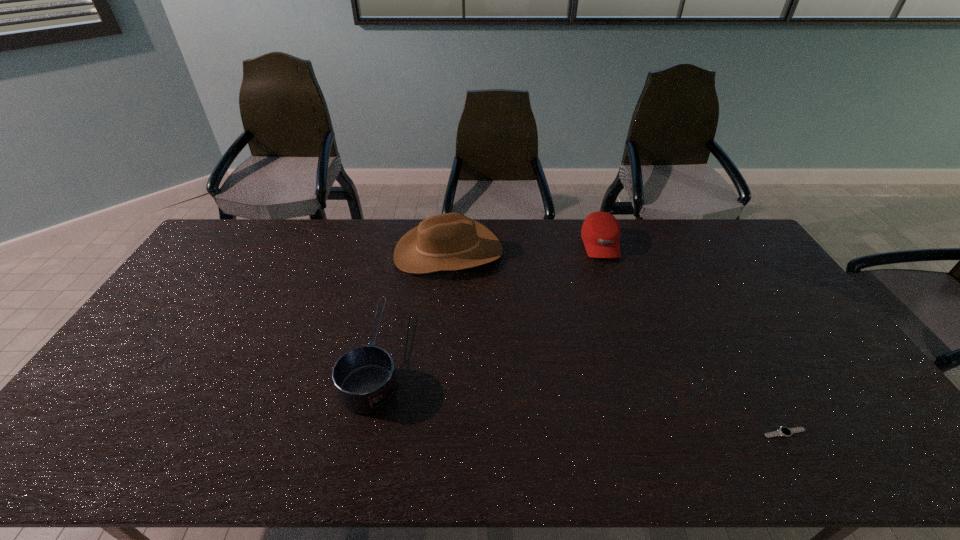
In order to click on free spot between the third object from left to right and the third farthest object in this screenshot , I will do `click(488, 302)`.

The height and width of the screenshot is (540, 960). What are the coordinates of `unoccupied area between the nearest object and the third farthest object` in the screenshot? It's located at (580, 396).

At what (x,y) coordinates should I click in order to perform the action: click on free area in between the cap and the cowboy hat. Please return your answer as a coordinate pair (x, y). Looking at the image, I should click on (524, 248).

What are the coordinates of `vacant area that lies between the second nearest object and the watch` in the screenshot? It's located at 580,396.

Find the location of a particular element. This screenshot has width=960, height=540. unoccupied position between the third farthest object and the tallest object is located at coordinates (412, 305).

Locate an element on the screen. The image size is (960, 540). free space between the cowboy hat and the rightmost object is located at coordinates (616, 342).

Identify the location of unoccupied area between the cowboy hat and the nearest object. This screenshot has height=540, width=960. (616, 342).

The image size is (960, 540). I want to click on empty space that is in between the shortest object and the second object from right to left, so click(x=692, y=339).

At what (x,y) coordinates should I click in order to perform the action: click on free space that is in between the saucepan and the tallest object. Please return your answer as a coordinate pair (x, y). Looking at the image, I should click on (412, 305).

Find the location of a particular element. This screenshot has width=960, height=540. free spot between the rightmost object and the tallest object is located at coordinates pyautogui.click(x=616, y=342).